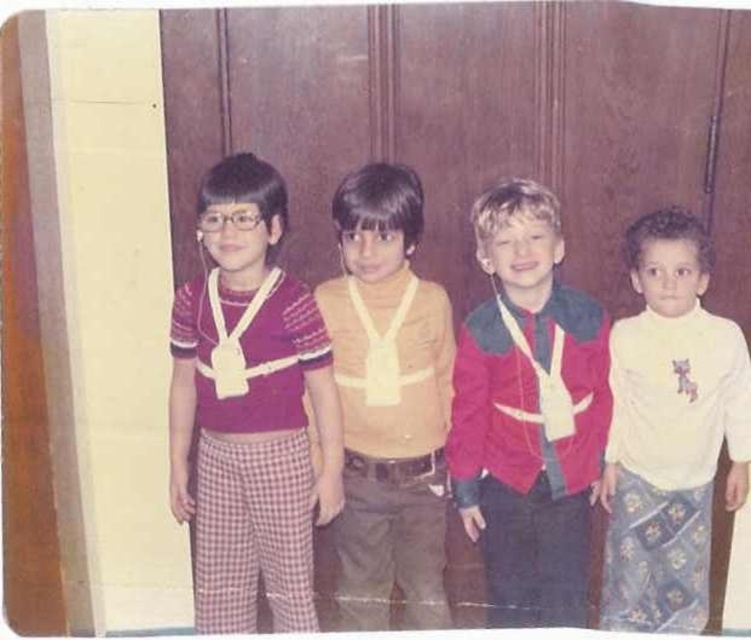
You are a photographer trying to capture a group photo of the matte yellow shirt at center and the white soft turtleneck at right. Since you want to ensure both subjects are centered in the frame, which direction should you move the camera to align them properly?

The matte yellow shirt at center is already positioned to the left of the white soft turtleneck at right. To center both in the frame, move the camera slightly to the right so that the matte yellow shirt at center shifts towards the center of the frame while the white soft turtleneck at right moves into the central area.

You are a photographer standing in front of the wooden wall where the children are positioned. You need to place a 36 inch wide banner between the matte red sweater at left and the white soft turtleneck at right. Will the banner fit comfortably between them?

The distance between the matte red sweater at left and the white soft turtleneck at right is 37.78 inches. Since the banner is 36 inches wide, it will fit comfortably between them with about 1.78 inches of space remaining.

Consider the image. You are a photographer trying to capture a group photo of the matte yellow shirt at center and the white soft turtleneck at right. The camera you are using has a minimum focus distance of 24 inches. Can you focus on both subjects simultaneously without moving the camera?

The matte yellow shirt at center and the white soft turtleneck at right are 24.24 inches apart from each other. Since the camera requires a minimum focus distance of 24 inches, the subjects are just within the required distance. Therefore, you can focus on both subjects simultaneously without moving the camera.